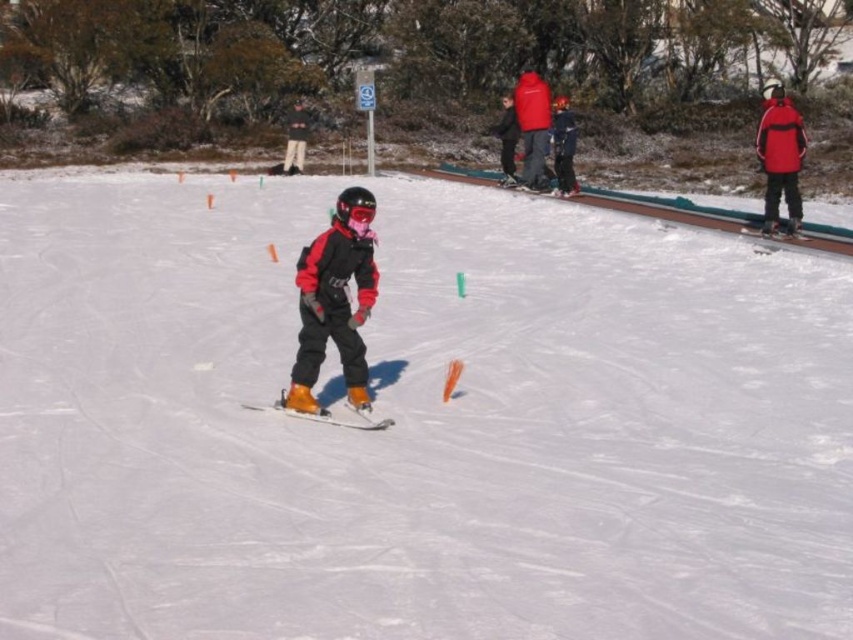
Question: Does red matte jacket at upper right appear under matte black jacket at upper center?

Choices:
 (A) no
 (B) yes

Answer: (B)

Question: Is matte black jacket at center closer to the viewer compared to matte black jacket at upper center?

Choices:
 (A) yes
 (B) no

Answer: (A)

Question: Is matte black snowboard at center smaller than red matte jacket at upper right?

Choices:
 (A) yes
 (B) no

Answer: (A)

Question: Which object is positioned farthest from the white matte snow at center?

Choices:
 (A) matte black jacket at center
 (B) matte red jacket at upper center
 (C) red matte jacket at upper right
 (D) matte black snowboard at center

Answer: (B)

Question: Considering the real-world distances, which object is closest to the red matte jacket at upper right?

Choices:
 (A) matte black jacket at upper center
 (B) matte black snowboard at center

Answer: (A)

Question: Which point is farther to the camera?

Choices:
 (A) matte black jacket at upper center
 (B) matte red jacket at upper center
 (C) matte black jacket at center
 (D) white matte snow at center

Answer: (A)